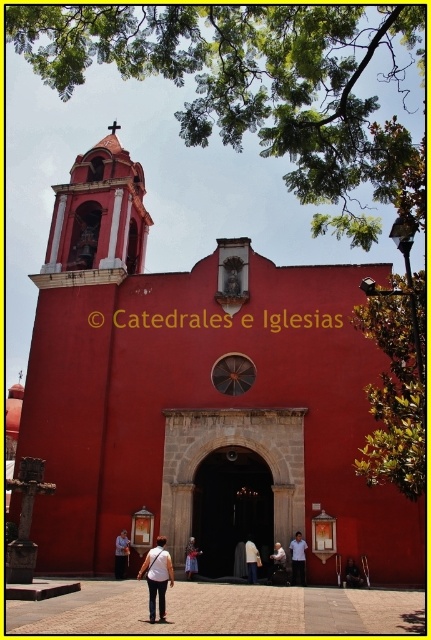
Question: Estimate the real-world distances between objects in this image. Which object is farther from the dark blue jeans at center?

Choices:
 (A) dark gray fabric jacket at center
 (B) white fabric shirt at center

Answer: (A)

Question: Which object is closer to the camera taking this photo?

Choices:
 (A) dark blue jeans at center
 (B) white cotton shirt at center
 (C) dark gray fabric jacket at center

Answer: (A)

Question: In this image, where is smooth red stone church at center located relative to white fabric dress at center?

Choices:
 (A) above
 (B) below

Answer: (A)

Question: Is white cotton shirt at center to the right of dark gray fabric jacket at center from the viewer's perspective?

Choices:
 (A) no
 (B) yes

Answer: (B)

Question: Is the position of denim jacket at center less distant than that of dark gray fabric jacket at center?

Choices:
 (A) no
 (B) yes

Answer: (A)

Question: Which point is closer to the camera taking this photo?

Choices:
 (A) (115, 548)
 (B) (156, 552)

Answer: (B)